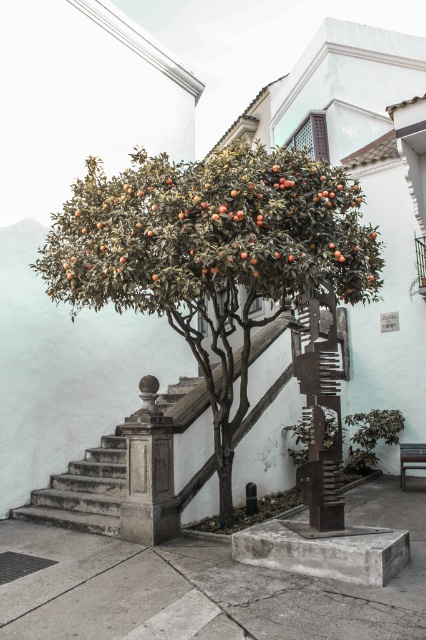
Can you confirm if green leafy tree at center is bigger than gray concrete stairs at center?

Indeed, green leafy tree at center has a larger size compared to gray concrete stairs at center.

Is green leafy tree at center positioned in front of gray concrete stairs at center?

Yes, it is in front of gray concrete stairs at center.

In order to click on green leafy tree at center in this screenshot , I will do `click(212, 253)`.